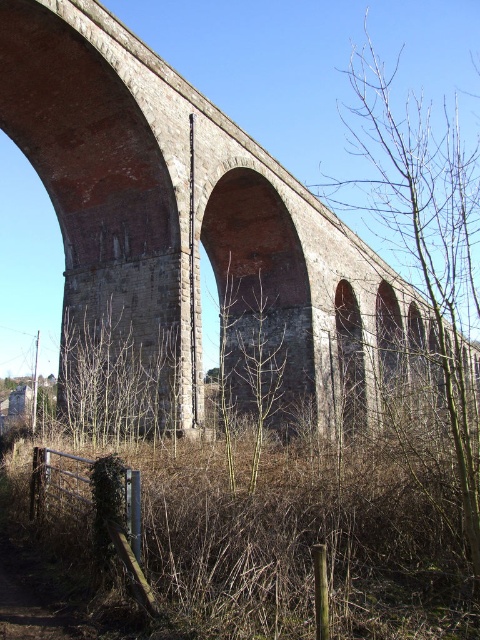
You are a maintenance worker needing to inspect both the red brick arch at center and the bare branches at right. If your ladder is 20 meters long, can you safely reach both objects from one position without moving the ladder?

The distance between the red brick arch at center and the bare branches at right is 21.45 meters. Since the ladder is only 20 meters long, it is not long enough to span the gap between them. You would need to move the ladder to reach both objects.

Looking at this image, you are a photographer wanting to capture the red brick arch at center and the bare branches at right in the same frame. Based on their positions, which object should appear closer to the camera in the photo?

The red brick arch at center should appear closer to the camera because the bare branches at right is behind it.